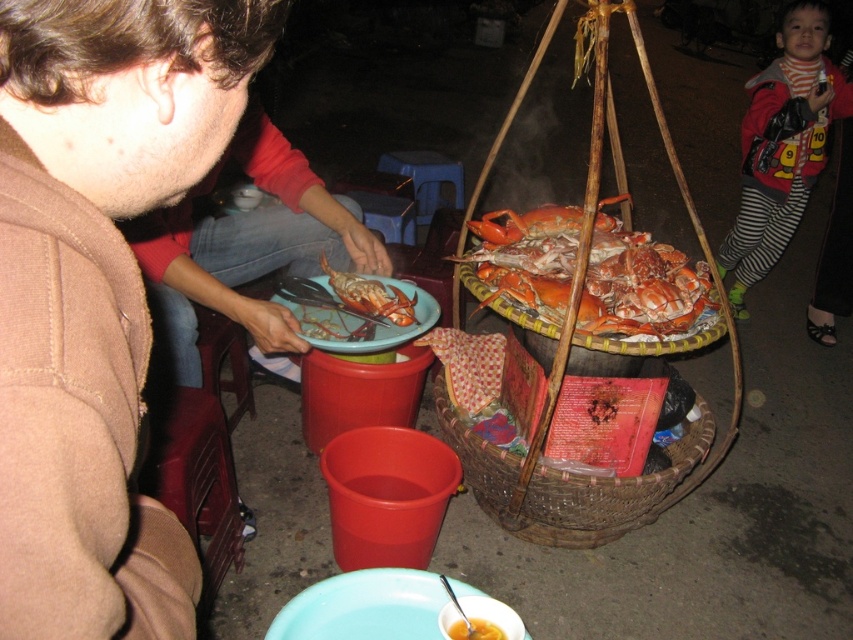
Is point (39, 26) closer to camera compared to point (695, 296)?

Yes, point (39, 26) is in front of point (695, 296).

Image resolution: width=853 pixels, height=640 pixels. Describe the element at coordinates (97, 291) in the screenshot. I see `brown woolen sweater at upper left` at that location.

Who is more distant from viewer, (55, 522) or (708, 305)?

Positioned behind is point (708, 305).

This screenshot has width=853, height=640. I want to click on brown woolen sweater at upper left, so click(97, 291).

Is orange shell crabs at center below woven brown basket at lower center?

No.

The image size is (853, 640). I want to click on orange shell crabs at center, so click(x=639, y=285).

Does orange shell crabs at center have a greater width compared to striped leggings at lower right?

Yes.

Does point (479, 275) come closer to viewer compared to point (811, 113)?

Yes, it is.

Measure the distance between point (x=543, y=216) and camera.

The distance of point (x=543, y=216) from camera is 1.91 meters.

In order to click on orange shell crabs at center in this screenshot , I will do `click(639, 285)`.